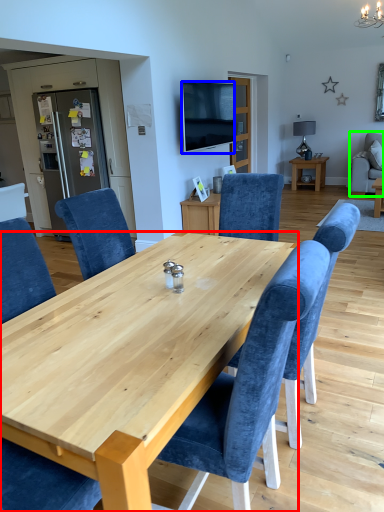
Question: Which object is the farthest from desk (highlighted by a red box)? Choose among these: television (highlighted by a blue box) or chair (highlighted by a green box).

Choices:
 (A) television
 (B) chair

Answer: (B)